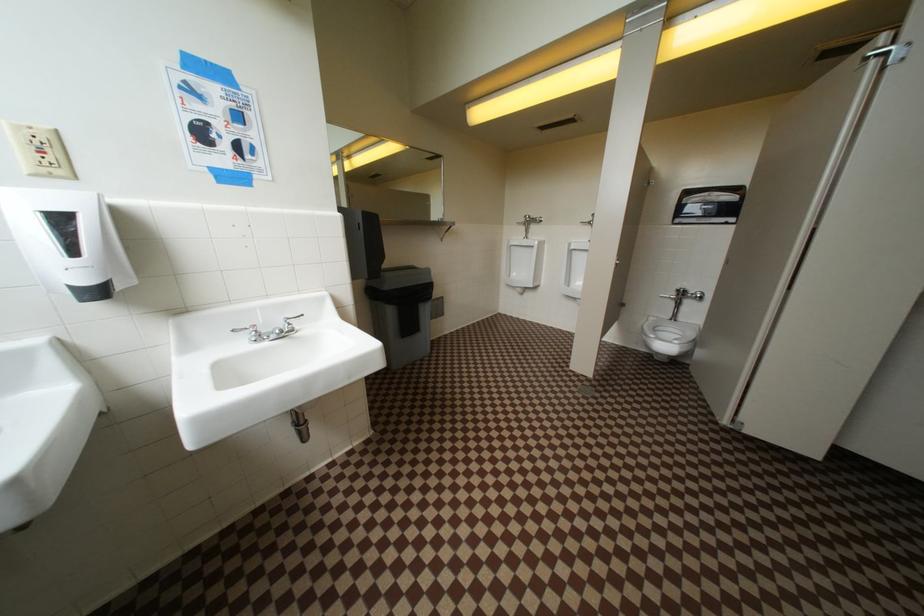
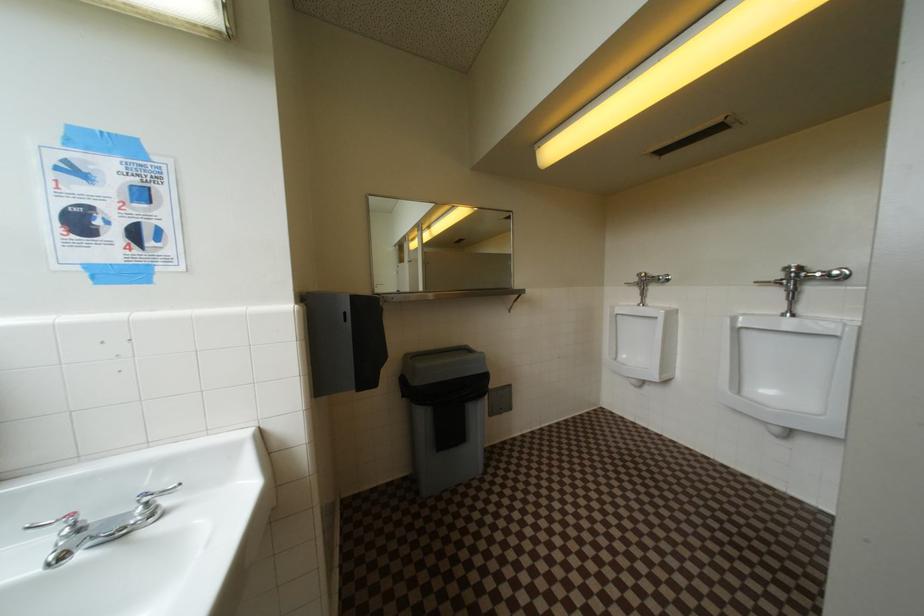
Question: Based on the continuous images, in which direction is the camera rotating? Reply with the corresponding letter.

Choices:
 (A) Left
 (B) Right
 (C) Up
 (D) Down

Answer: (A)